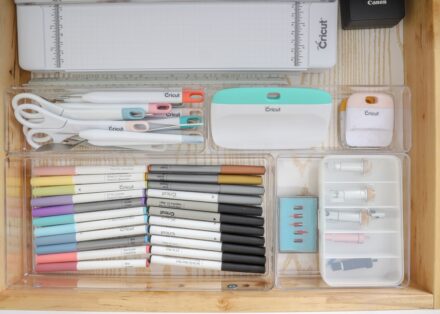
Locate an element on the screen. black marker caps is located at coordinates (236, 267), (237, 259), (235, 247), (236, 240), (236, 228), (236, 220), (237, 210).